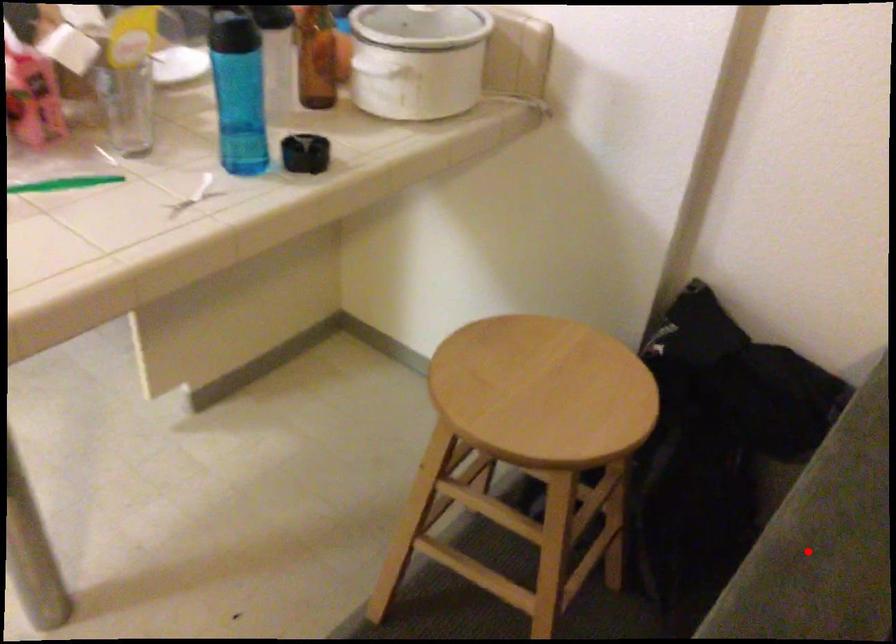
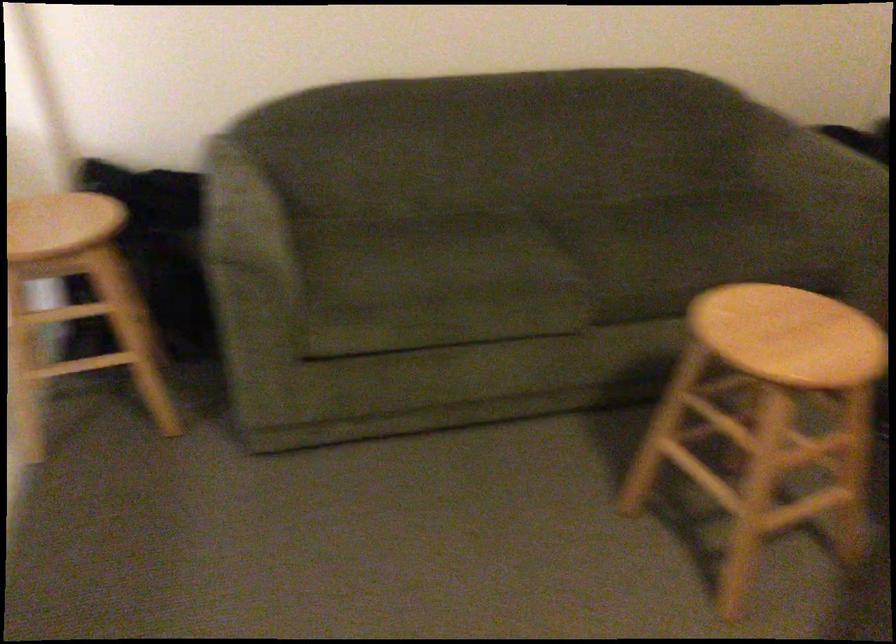
Question: I am providing you with two images of the same scene from different viewpoints. A red point is marked on the first image. Is the red point's position out of view in image 2?

Choices:
 (A) Yes
 (B) No

Answer: (B)